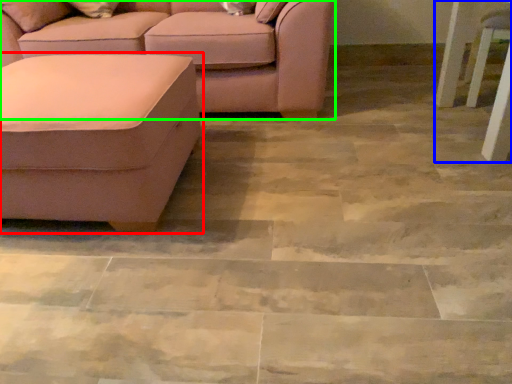
Question: Which object is positioned closest to studio couch (highlighted by a red box)? Select from side table (highlighted by a blue box) and studio couch (highlighted by a green box).

Choices:
 (A) side table
 (B) studio couch

Answer: (B)